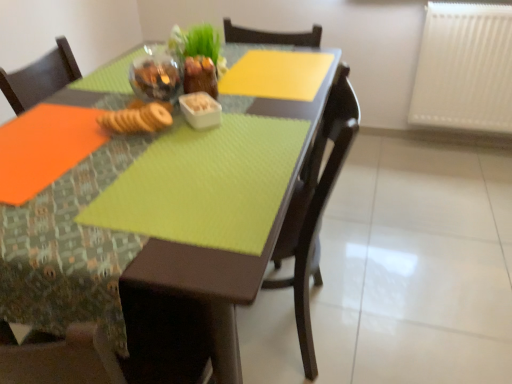
At what (x,y) coordinates should I click in order to perform the action: click on free space above white plastic radiator at upper right (from a real-world perspective). Please return your answer as a coordinate pair (x, y). The width and height of the screenshot is (512, 384). Looking at the image, I should click on (476, 0).